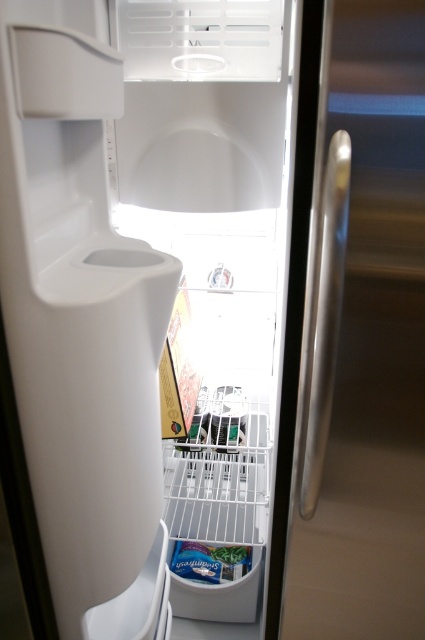
You are trying to reach the satin silver handle at center right while holding a 20 inch long grocery bag. Can you grab the handle without dropping the bag?

The distance between the objects is 23.23 inches, so yes, you can grab the satin silver handle at center right without dropping the bag since the bag is shorter than the distance.

You are trying to grab the green matte vegetable at lower center from inside the refrigerator. However, the satin silver handle at center right is in the way. Can you move the handle to access the vegetable?

The satin silver handle at center right is larger in size than green matte vegetable at lower center, so it might block access. However, handles are typically stationary and cannot be moved, so you would need to reach around or behind the handle to access the vegetable.

In the scene shown: You are trying to open the refrigerator door but can only reach the area near the center right. Is the satin silver handle at center right located in that area?

Yes, the satin silver handle at center right is located at point (362, 346), which is near the center right, so you can reach it.